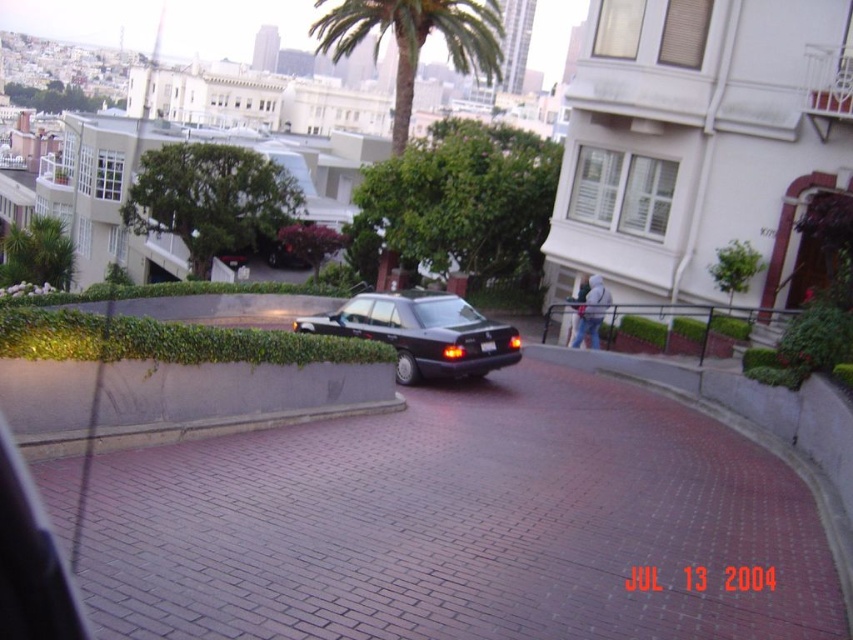
Question: Estimate the real-world distances between objects in this image. Which object is farther from the green leafy palm tree at upper center?

Choices:
 (A) satin black sedan at center
 (B) black plastic license plate at center

Answer: (B)

Question: Which point appears closest to the camera in this image?

Choices:
 (A) (482, 49)
 (B) (480, 342)

Answer: (B)

Question: Can you confirm if green leafy palm tree at upper center is positioned below black plastic license plate at center?

Choices:
 (A) yes
 (B) no

Answer: (B)

Question: Which object is positioned closest to the satin black sedan at center?

Choices:
 (A) green leafy palm tree at upper center
 (B) black plastic license plate at center

Answer: (B)

Question: Is satin black sedan at center closer to camera compared to black plastic license plate at center?

Choices:
 (A) no
 (B) yes

Answer: (B)

Question: Is satin black sedan at center below black plastic license plate at center?

Choices:
 (A) yes
 (B) no

Answer: (B)